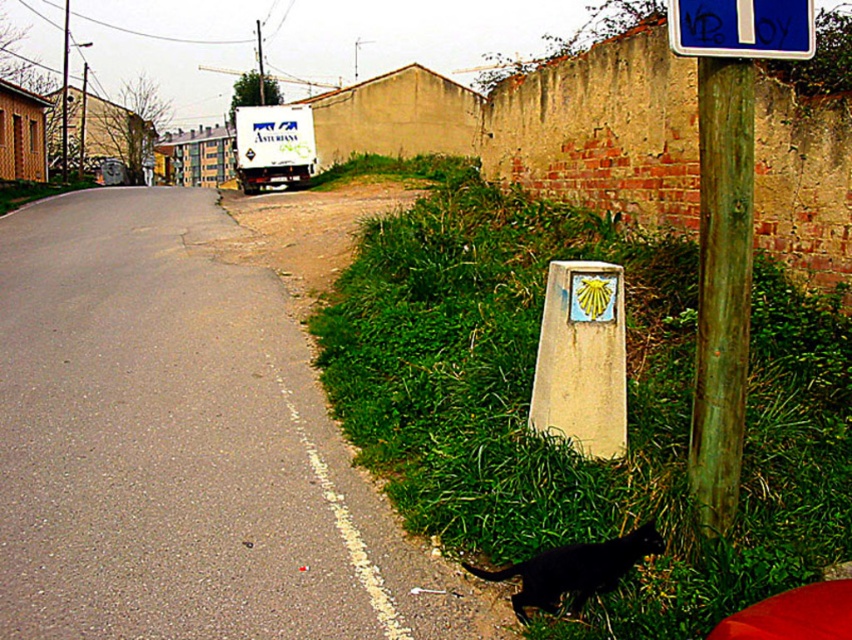
Question: Is gray asphalt road at lower left positioned before black fur cat at lower right?

Choices:
 (A) no
 (B) yes

Answer: (A)

Question: Which point is farther to the camera?

Choices:
 (A) blue plastic sign at upper center
 (B) black fur cat at lower right
 (C) green grass at lower right
 (D) gray asphalt road at lower left

Answer: (A)

Question: Can you confirm if wooden post at upper right is positioned above black fur cat at lower right?

Choices:
 (A) yes
 (B) no

Answer: (A)

Question: Is green grass at lower right positioned before green wood pole at right?

Choices:
 (A) no
 (B) yes

Answer: (B)

Question: Considering the real-world distances, which object is closest to the gray asphalt road at lower left?

Choices:
 (A) wooden post at upper right
 (B) green grass at lower right

Answer: (B)

Question: Which of the following is the closest to the observer?

Choices:
 (A) blue plastic sign at upper center
 (B) gray asphalt road at lower left
 (C) green wood pole at right

Answer: (B)